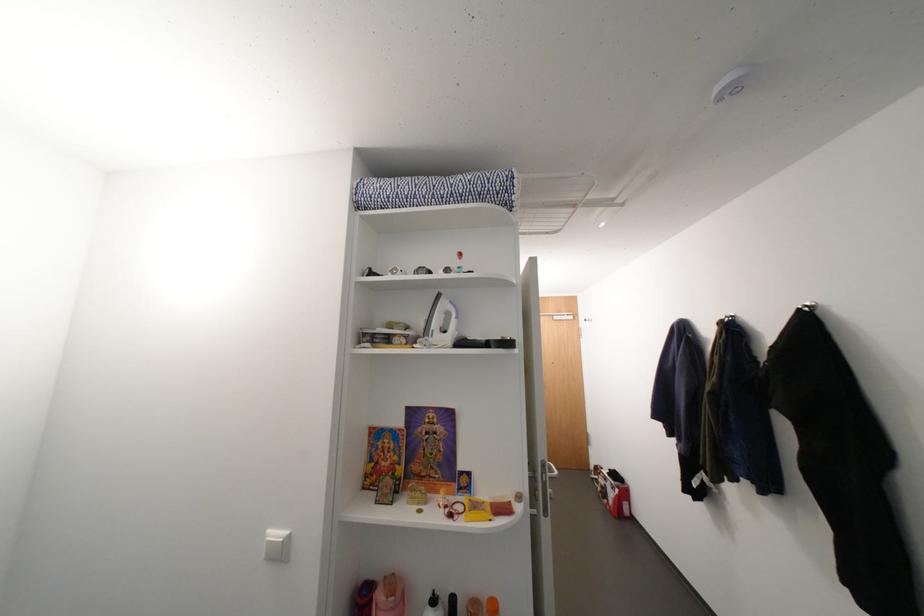
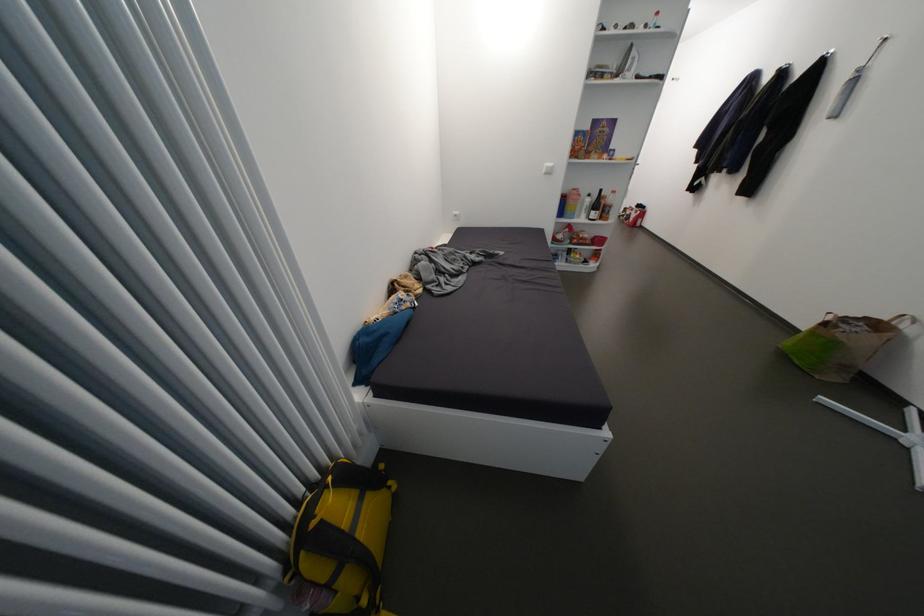
Where in the second image is the point corresponding to [621,488] from the first image?

(642, 214)